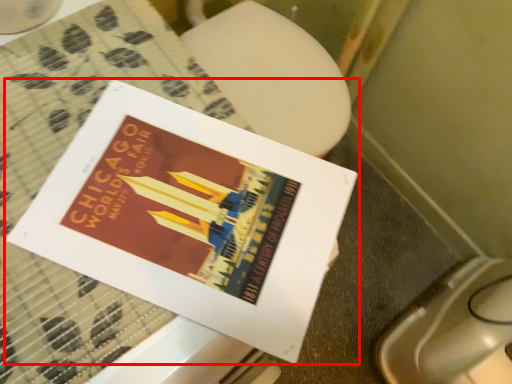
Question: Considering the relative positions of book (annotated by the red box) and toilet bowl in the image provided, where is book (annotated by the red box) located with respect to the staircase?

Choices:
 (A) right
 (B) left

Answer: (B)